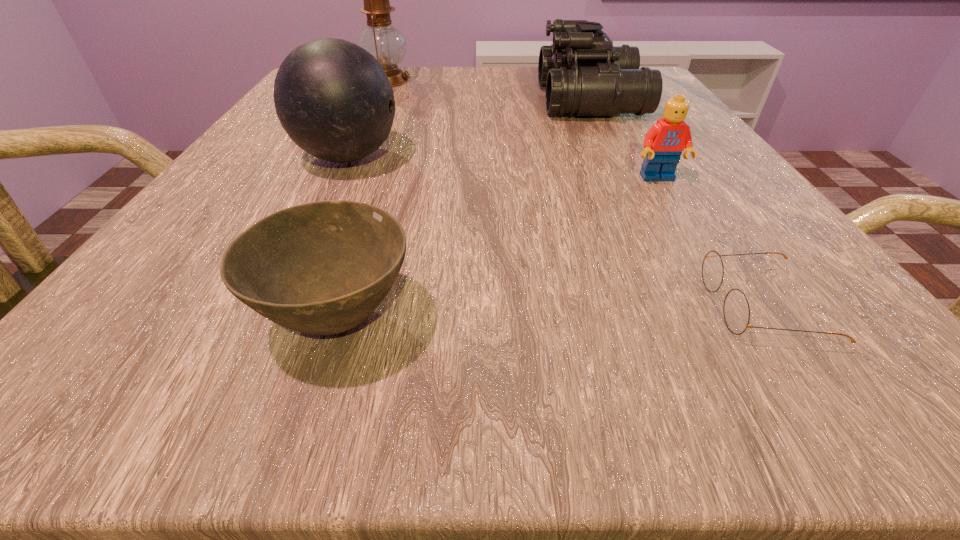
This screenshot has width=960, height=540. In the image, there is a desktop. Identify the location of vacant space at the far edge. (420, 97).

You are a GUI agent. You are given a task and a screenshot of the screen. Output one action in this format:
    pyautogui.click(x=<x>, y=<y>)
    Task: Click on the vacant space at the near edge of the desktop
    The height and width of the screenshot is (540, 960).
    Given the screenshot: What is the action you would take?
    pyautogui.click(x=665, y=328)

You are a GUI agent. You are given a task and a screenshot of the screen. Output one action in this format:
    pyautogui.click(x=<x>, y=<y>)
    Task: Click on the vacant region at the left edge
    
    Given the screenshot: What is the action you would take?
    pyautogui.click(x=272, y=192)

Find the location of a particular element. This screenshot has width=960, height=540. vacant space at the right edge of the desktop is located at coordinates (623, 165).

At what (x,y) coordinates should I click in order to perform the action: click on vacant area at the near left corner. Please return your answer as a coordinate pair (x, y). Looking at the image, I should click on (103, 325).

You are a GUI agent. You are given a task and a screenshot of the screen. Output one action in this format:
    pyautogui.click(x=<x>, y=<y>)
    Task: Click on the free area in between the second shortest object and the Lego
    
    Given the screenshot: What is the action you would take?
    pyautogui.click(x=497, y=248)

Identify the location of free space that is in between the bowl and the binoculars. Image resolution: width=960 pixels, height=540 pixels. (464, 209).

Where is `free space between the oil lamp and the second shortest object`? This screenshot has height=540, width=960. free space between the oil lamp and the second shortest object is located at coordinates (362, 199).

At what (x,y) coordinates should I click in order to perform the action: click on unoccupied position between the binoculars and the bowling ball. Please return your answer as a coordinate pair (x, y). Image resolution: width=960 pixels, height=540 pixels. Looking at the image, I should click on (469, 129).

Where is `free space between the Lego and the binoculars`? Image resolution: width=960 pixels, height=540 pixels. free space between the Lego and the binoculars is located at coordinates (624, 139).